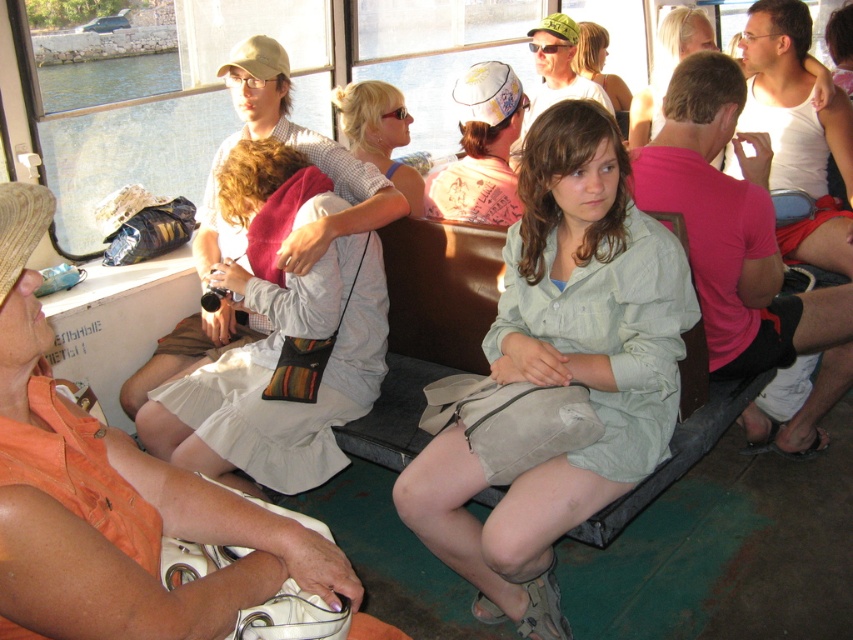
Is point (614, 488) positioned behind point (712, 44)?

No, it is in front of (712, 44).

Locate an element on the screen. The height and width of the screenshot is (640, 853). light green fabric dress at center is located at coordinates (563, 368).

Can you confirm if light green fabric dress at center is positioned below pink cotton shirt at center?

Indeed, light green fabric dress at center is positioned under pink cotton shirt at center.

Is light green fabric dress at center shorter than pink cotton shirt at center?

No.

Is point (612, 460) in front of point (483, 108)?

That is True.

Find the location of `light green fabric dress at center`. light green fabric dress at center is located at coordinates (563, 368).

Who is more forward, (633, 211) or (727, 291)?

Point (633, 211) is more forward.

Can you confirm if light green fabric dress at center is positioned above pink fabric shirt at right?

Actually, light green fabric dress at center is below pink fabric shirt at right.

Who is more forward, (560, 257) or (761, 253)?

Positioned in front is point (560, 257).

Where is `light green fabric dress at center`? The image size is (853, 640). light green fabric dress at center is located at coordinates (563, 368).